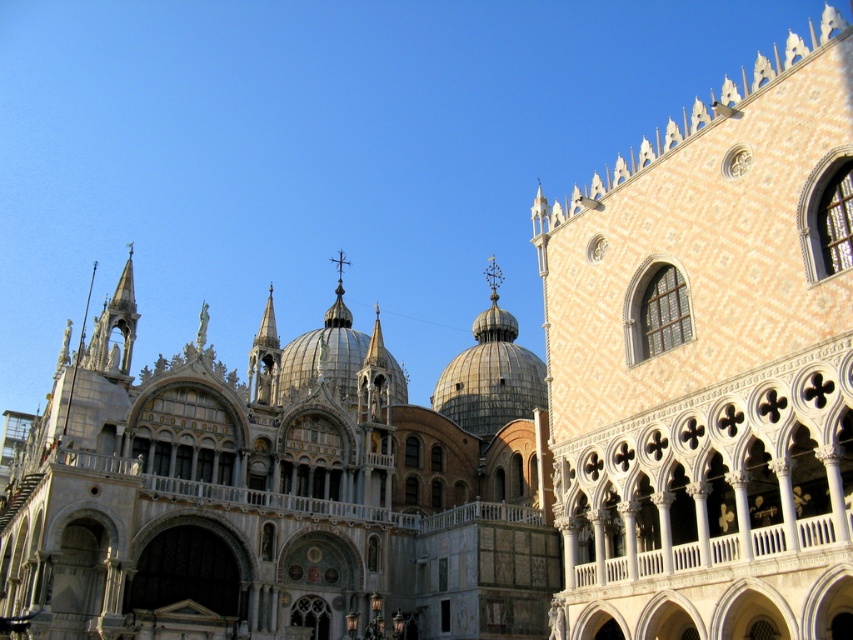
Question: Does white textured building at upper right appear on the right side of white marble church at center?

Choices:
 (A) yes
 (B) no

Answer: (A)

Question: Which point appears closest to the camera in this image?

Choices:
 (A) (782, 460)
 (B) (64, 477)

Answer: (A)

Question: Is white textured building at upper right positioned in front of white marble church at center?

Choices:
 (A) yes
 (B) no

Answer: (A)

Question: Which point appears closest to the camera in this image?

Choices:
 (A) (13, 593)
 (B) (579, 371)

Answer: (B)

Question: Which point is closer to the camera taking this photo?

Choices:
 (A) (430, 621)
 (B) (767, 364)

Answer: (B)

Question: Considering the relative positions of white textured building at upper right and white marble church at center in the image provided, where is white textured building at upper right located with respect to white marble church at center?

Choices:
 (A) right
 (B) left

Answer: (A)